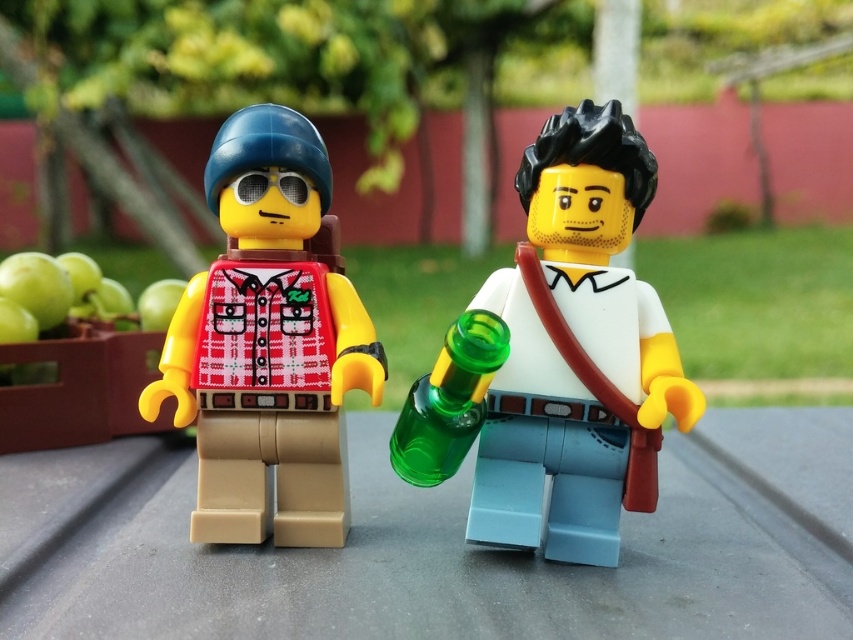
You are trying to determine which minifigure has a bigger torso. You see the smooth white shirt at center and the matte red plaid shirt at center. Which one has a larger torso?

The smooth white shirt at center has a larger torso than the matte red plaid shirt at center.

You are a photographer trying to capture a closeup of the LEGO minifigures. You notice two points in the scene at coordinates point (618, 477) and point (281, 458). Which point should you focus on to ensure the closest minifigure is in sharp focus?

Point (618, 477) is closer to the camera than point (281, 458), so focusing on point (618, 477) will ensure the closest minifigure is in sharp focus.

You are standing in a park and see two LEGO minifigures on a wooden surface. The minifigures are wearing a smooth white shirt at center and a matte red plaid shirt at center. Which minifigure is positioned more to the right?

The smooth white shirt at center is positioned more to the right than the matte red plaid shirt at center.